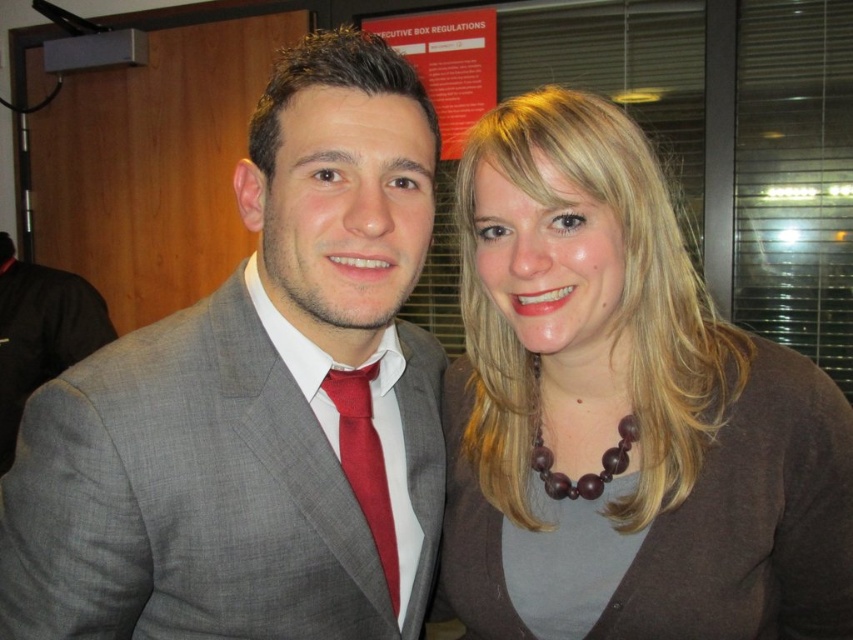
You are a photographer setting up for a group photo. You notice two matte gray suits in the frame. The person wearing the matte gray suit at center is standing behind the person wearing the matte gray suit at left. Can you determine which of the two matte gray suits will be more visible in the final photo?

The matte gray suit at center is above matte gray suit at left, so the person wearing the matte gray suit at center will be more visible in the final photo because they are positioned higher in the frame.

Looking at this image, you are standing in front of the two people in the image and want to touch the point at coordinates [258,403]. Which person should you approach to reach that point?

The point at coordinates [258,403] is located on the matte gray suit at center, so you should approach the man on the left who is wearing the gray suit jacket.

You are standing in front of the image and want to describe the position of the matte gray suit at center. What are its coordinates?

The matte gray suit at center is located at coordinates point (258, 403).